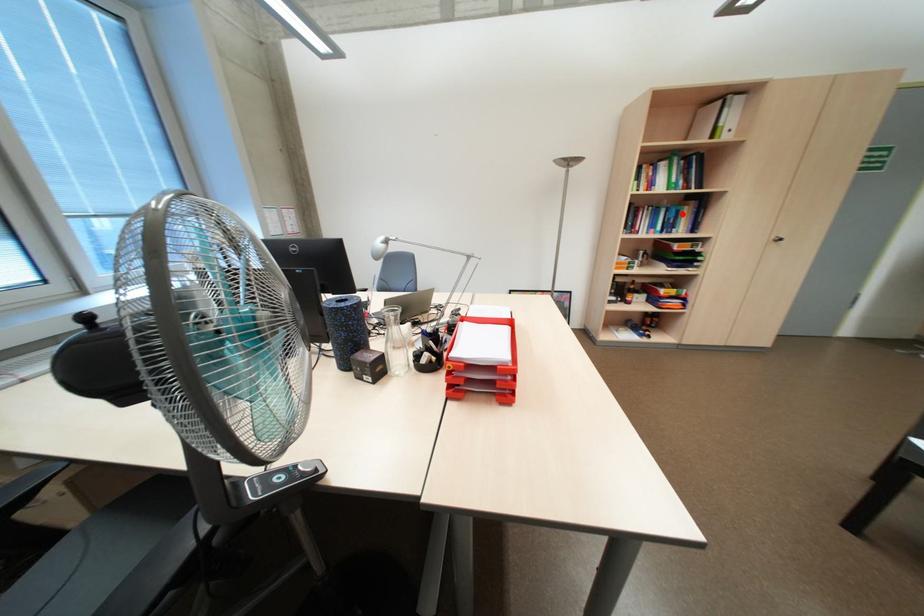
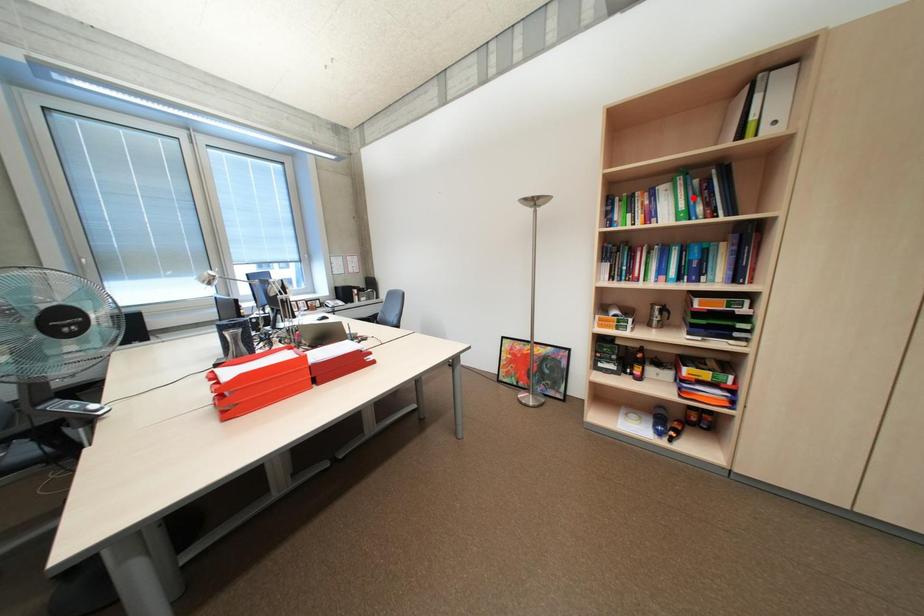
I am providing you with two images of the same scene from different viewpoints. A red point is marked on the first image and another point is marked on the second image. Is the red point in image1 aligned with the point shown in image2?

No